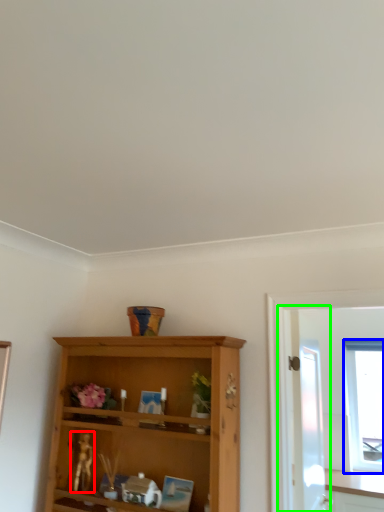
Question: Based on their relative distances, which object is farther from miniature (highlighted by a red box)? Choose from window (highlighted by a blue box) and screen door (highlighted by a green box).

Choices:
 (A) window
 (B) screen door

Answer: (A)